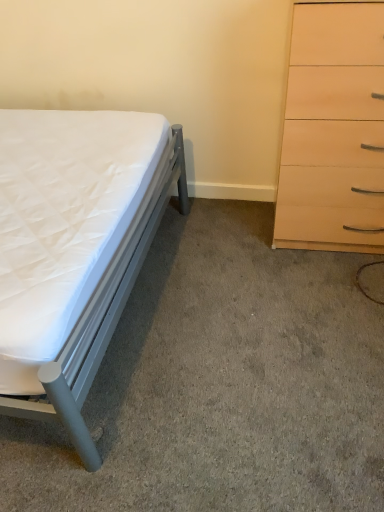
Describe the element at coordinates (223, 383) in the screenshot. The width and height of the screenshot is (384, 512). I see `white quilted mattress at lower left` at that location.

What do you see at coordinates (74, 248) in the screenshot? I see `white quilted mattress at left` at bounding box center [74, 248].

At what (x,y) coordinates should I click in order to perform the action: click on light wood/finish chest of drawers at right. Please return your answer as a coordinate pair (x, y). Looking at the image, I should click on (333, 131).

Is white quilted mattress at lower left directly adjacent to white quilted mattress at left?

No, white quilted mattress at lower left is not next to white quilted mattress at left.

Considering the relative sizes of white quilted mattress at lower left and white quilted mattress at left in the image provided, is white quilted mattress at lower left bigger than white quilted mattress at left?

No, white quilted mattress at lower left is not bigger than white quilted mattress at left.

How much distance is there between white quilted mattress at lower left and white quilted mattress at left?

48.97 centimeters.

This screenshot has width=384, height=512. I want to click on bed above the white quilted mattress at lower left (from the image's perspective), so click(74, 248).

Is white quilted mattress at left oriented away from white quilted mattress at lower left?

No, white quilted mattress at left is not facing away from white quilted mattress at lower left.

In the scene shown: Is white quilted mattress at left not close to white quilted mattress at lower left?

No, white quilted mattress at left is not far away from white quilted mattress at lower left.

Does white quilted mattress at left lie in front of white quilted mattress at lower left?

Yes, white quilted mattress at left is in front of white quilted mattress at lower left.

Relative to white quilted mattress at left, is light wood/finish chest of drawers at right in front or behind?

In the image, light wood/finish chest of drawers at right appears behind white quilted mattress at left.

Measure the distance between light wood/finish chest of drawers at right and white quilted mattress at left.

A distance of 32.21 inches exists between light wood/finish chest of drawers at right and white quilted mattress at left.

Considering the sizes of objects light wood/finish chest of drawers at right and white quilted mattress at left in the image provided, who is shorter, light wood/finish chest of drawers at right or white quilted mattress at left?

With less height is white quilted mattress at left.

Is light wood/finish chest of drawers at right directly adjacent to white quilted mattress at left?

light wood/finish chest of drawers at right and white quilted mattress at left are clearly separated.

Does point (362, 110) come behind point (160, 442)?

That is True.

How different are the orientations of light wood/finish chest of drawers at right and white quilted mattress at lower left in degrees?

0.658 degrees separate the facing orientations of light wood/finish chest of drawers at right and white quilted mattress at lower left.

Is light wood/finish chest of drawers at right with white quilted mattress at lower left?

No, light wood/finish chest of drawers at right is not touching white quilted mattress at lower left.

Who is bigger, light wood/finish chest of drawers at right or white quilted mattress at lower left?

Bigger between the two is light wood/finish chest of drawers at right.

From a real-world perspective, is white quilted mattress at left physically located above or below light wood/finish chest of drawers at right?

In terms of real-world spatial position, white quilted mattress at left is below light wood/finish chest of drawers at right.

Consider the image. Would you say white quilted mattress at left is to the left or to the right of light wood/finish chest of drawers at right in the picture?

Clearly, white quilted mattress at left is on the left of light wood/finish chest of drawers at right in the image.

Which is nearer, (164, 207) or (360, 244)?

The point (360, 244) is closer to the camera.

Is the position of white quilted mattress at left more distant than that of light wood/finish chest of drawers at right?

No, white quilted mattress at left is closer to the camera.

From a real-world perspective, is white quilted mattress at lower left above or below light wood/finish chest of drawers at right?

white quilted mattress at lower left is situated lower than light wood/finish chest of drawers at right in the real world.

Is point (181, 457) farther from camera compared to point (360, 45)?

No, (181, 457) is in front of (360, 45).

Who is shorter, white quilted mattress at lower left or light wood/finish chest of drawers at right?

white quilted mattress at lower left is shorter.

You are a GUI agent. You are given a task and a screenshot of the screen. Output one action in this format:
    pyautogui.click(x=<x>, y=<y>)
    Task: Click on the concrete lying below the white quilted mattress at left (from the image's perspective)
    The height and width of the screenshot is (512, 384).
    Given the screenshot: What is the action you would take?
    pyautogui.click(x=223, y=383)

This screenshot has width=384, height=512. I want to click on concrete on the right of white quilted mattress at left, so click(223, 383).

Based on their spatial positions, is white quilted mattress at left or white quilted mattress at lower left closer to light wood/finish chest of drawers at right?

Among the two, white quilted mattress at lower left is located nearer to light wood/finish chest of drawers at right.

Estimate the real-world distances between objects in this image. Which object is closer to white quilted mattress at left, light wood/finish chest of drawers at right or white quilted mattress at lower left?

white quilted mattress at lower left.

From the image, which object appears to be farther from white quilted mattress at left, white quilted mattress at lower left or light wood/finish chest of drawers at right?

light wood/finish chest of drawers at right lies further to white quilted mattress at left than the other object.

When comparing their distances from white quilted mattress at lower left, does white quilted mattress at left or light wood/finish chest of drawers at right seem closer?

Based on the image, white quilted mattress at left appears to be nearer to white quilted mattress at lower left.

From the picture: Which object lies further to the anchor point light wood/finish chest of drawers at right, white quilted mattress at lower left or white quilted mattress at left?

white quilted mattress at left lies further to light wood/finish chest of drawers at right than the other object.

Which object lies nearer to the anchor point white quilted mattress at lower left, light wood/finish chest of drawers at right or white quilted mattress at left?

white quilted mattress at left lies closer to white quilted mattress at lower left than the other object.

The image size is (384, 512). I want to click on concrete between white quilted mattress at left and light wood/finish chest of drawers at right from left to right, so click(223, 383).